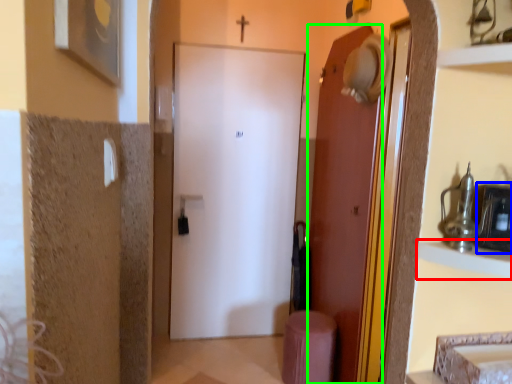
Question: Which object is the closest to the cabinet (highlighted by a red box)? Choose among these: medicine cabinet (highlighted by a blue box) or door (highlighted by a green box).

Choices:
 (A) medicine cabinet
 (B) door

Answer: (A)